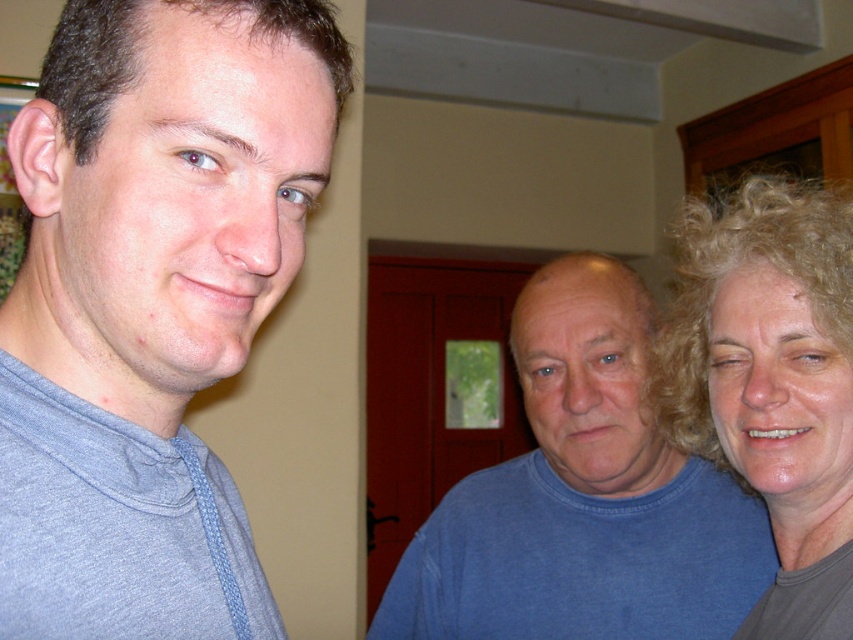
Question: Among these objects, which one is nearest to the camera?

Choices:
 (A) blue cotton shirt at center
 (B) gray cotton shirt at left
 (C) curly blonde hair at right

Answer: (B)

Question: Can you confirm if gray cotton shirt at left is bigger than blue cotton shirt at center?

Choices:
 (A) yes
 (B) no

Answer: (B)

Question: Is gray cotton shirt at left further to camera compared to blue cotton shirt at center?

Choices:
 (A) yes
 (B) no

Answer: (B)

Question: Which point is farther to the camera?

Choices:
 (A) (844, 592)
 (B) (695, 609)

Answer: (B)

Question: Among these objects, which one is farthest from the camera?

Choices:
 (A) curly blonde hair at right
 (B) gray cotton shirt at left
 (C) blue cotton shirt at center

Answer: (C)

Question: Does gray cotton shirt at left come in front of curly blonde hair at right?

Choices:
 (A) no
 (B) yes

Answer: (B)